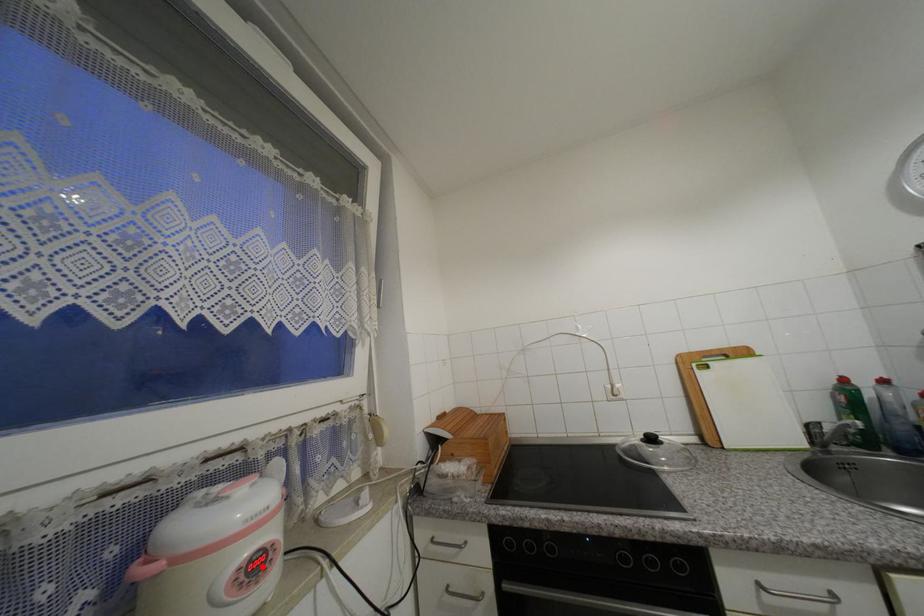
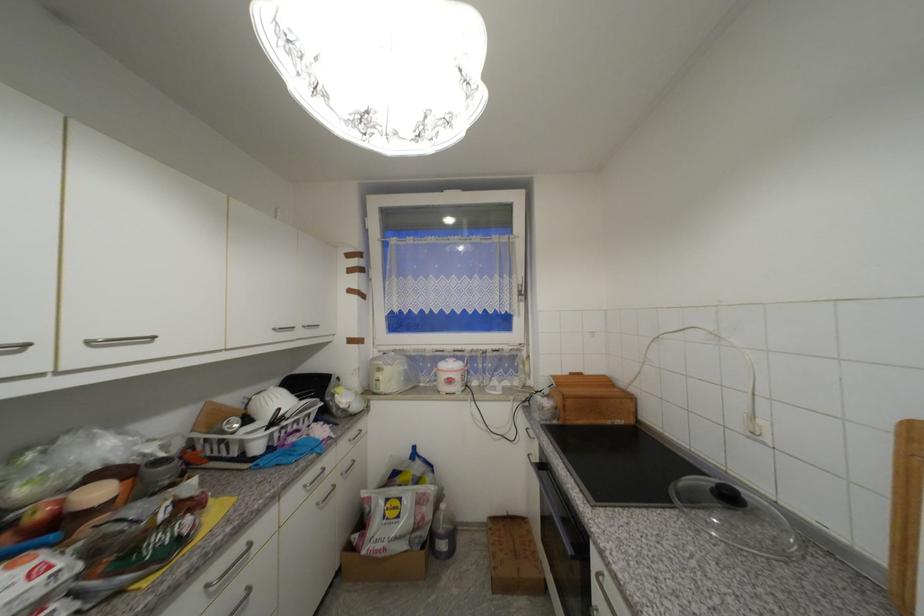
In the second image, find the point that corresponds to the highlighted location in the first image.

(456, 382)